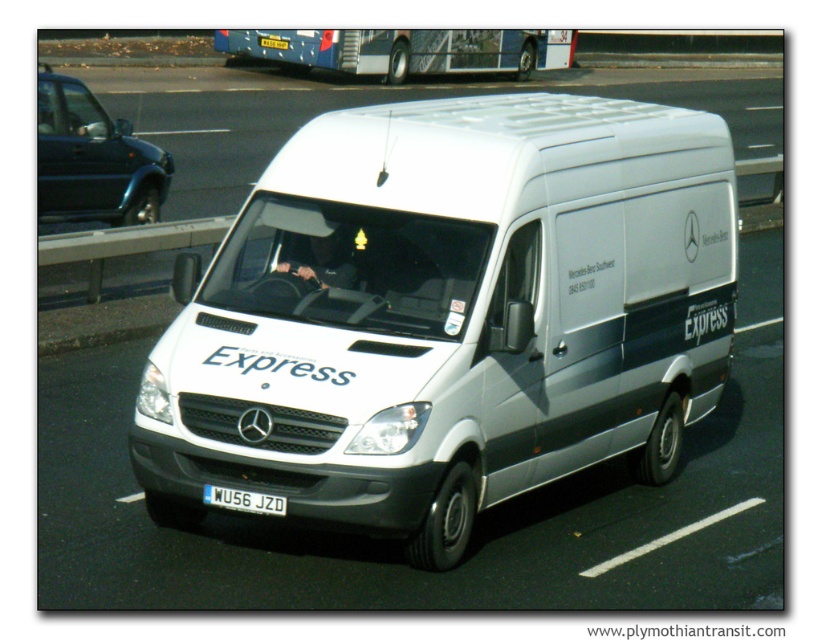
Between white glossy van at center and white metallic license plate at center, which one is positioned higher?

white glossy van at center is higher up.

Is white glossy van at center positioned in front of white metallic license plate at center?

No, white glossy van at center is further to the viewer.

Which is behind, point (219, 136) or point (252, 512)?

The point (219, 136) is behind.

The image size is (822, 640). I want to click on white glossy van at center, so click(389, 100).

Is point (746, 108) farther from camera compared to point (465, 38)?

Yes, point (746, 108) is farther from viewer.

Does white glossy van at center appear on the left side of blue metallic bus at upper center?

In fact, white glossy van at center is to the right of blue metallic bus at upper center.

What do you see at coordinates (389, 100) in the screenshot?
I see `white glossy van at center` at bounding box center [389, 100].

Locate an element on the screen. This screenshot has width=822, height=640. white glossy van at center is located at coordinates (389, 100).

Does white matte van at center lie in front of blue metallic bus at upper center?

Yes, white matte van at center is closer to the viewer.

Who is positioned more to the right, white matte van at center or blue metallic bus at upper center?

Positioned to the right is white matte van at center.

Which is behind, point (186, 264) or point (312, 38)?

Point (312, 38)

Identify the location of white matte van at center. (449, 314).